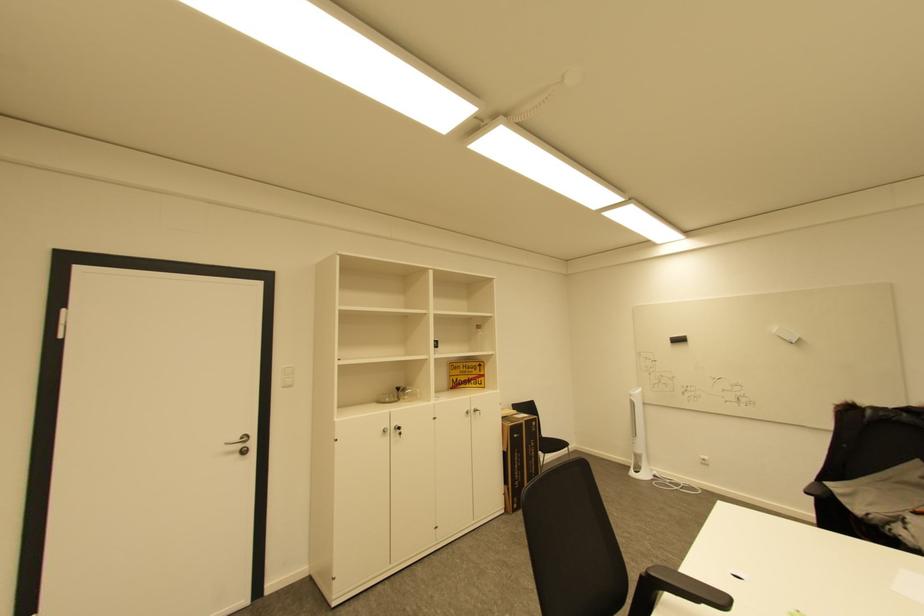
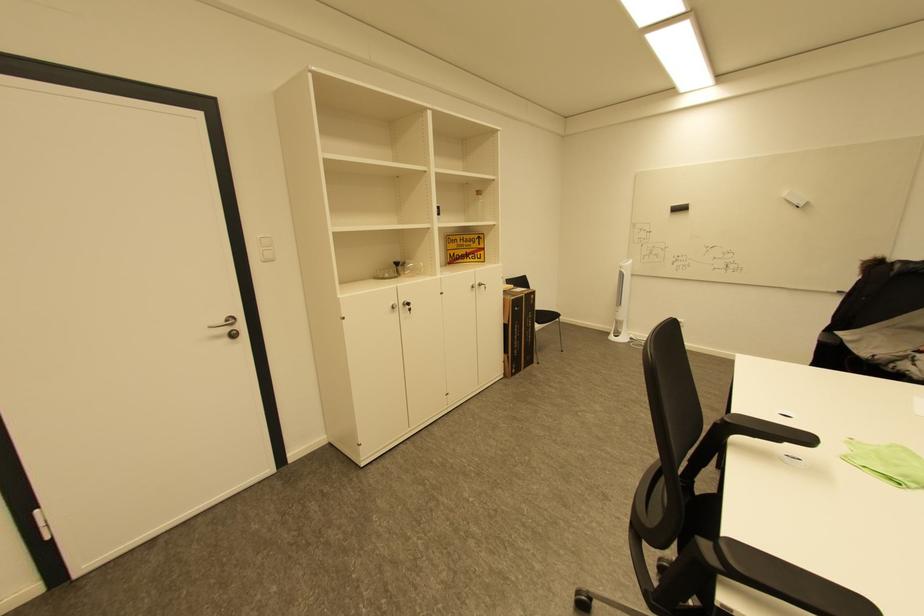
In the second image, find the point that corresponds to (391,432) in the first image.

(398, 308)